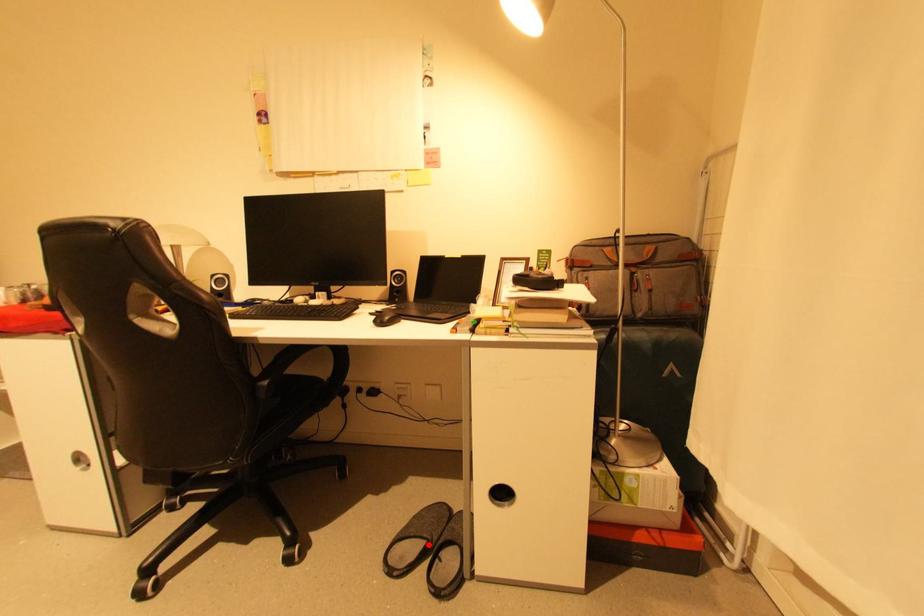
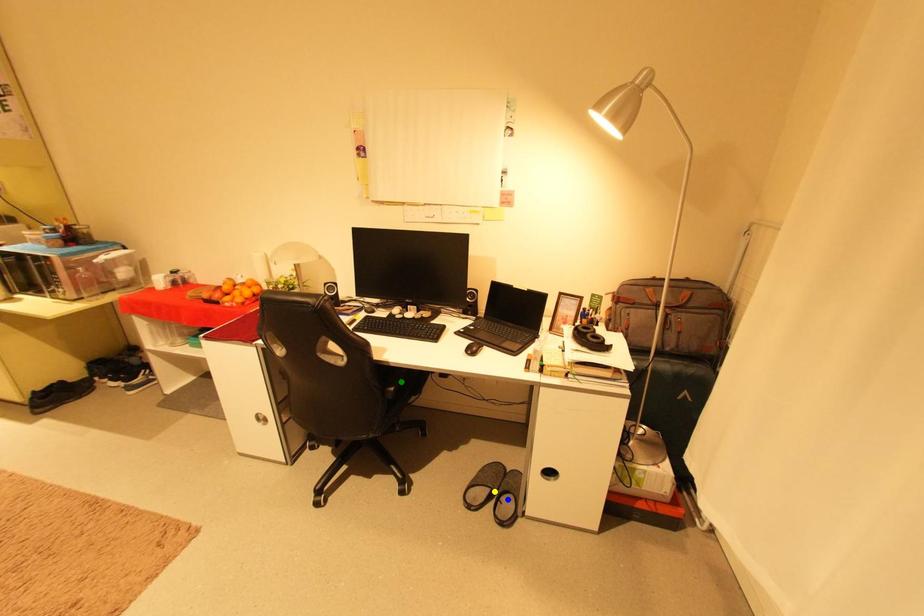
Question: I am providing you with two images of the same scene from different viewpoints. A red point is marked on the first image. You are given multiple points on the second image. Which spot in image 2 lines up with the point in image 1?

Choices:
 (A) blue point
 (B) yellow point
 (C) green point

Answer: (B)